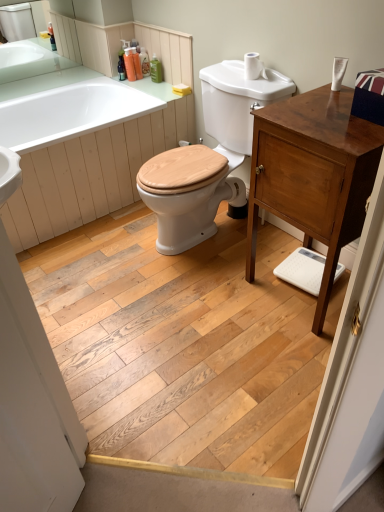
Identify the location of vacant space in front of translucent plastic soap dispenser at upper center, placed as the third toiletry when sorted from left to right. Image resolution: width=384 pixels, height=512 pixels. (149, 81).